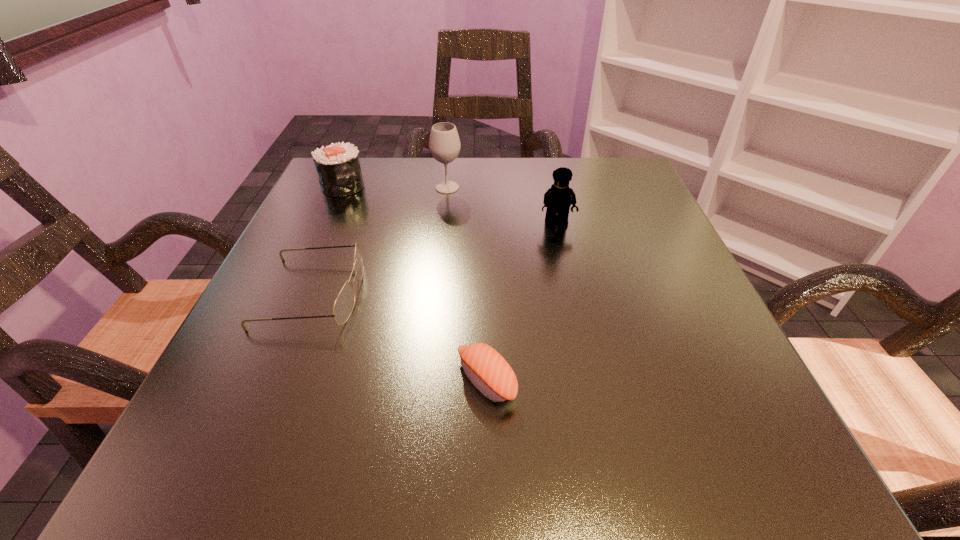
Locate an element on the screen. Image resolution: width=960 pixels, height=540 pixels. vacant region located 0.250m on the front-facing side of the third nearest object is located at coordinates (579, 326).

Where is `free spot located on the front of the farther sushi`? free spot located on the front of the farther sushi is located at coordinates (316, 247).

This screenshot has height=540, width=960. What are the coordinates of `free point located on the back of the right sushi` in the screenshot? It's located at (485, 261).

Locate an element on the screen. The image size is (960, 540). free spot located 0.260m on the front-facing side of the spectacles is located at coordinates (516, 293).

This screenshot has width=960, height=540. Identify the location of wineglass that is at the far edge. (444, 143).

Image resolution: width=960 pixels, height=540 pixels. I want to click on sushi that is positioned at the far edge, so (338, 167).

This screenshot has height=540, width=960. Identify the location of sushi that is at the left edge. (338, 167).

Locate an element on the screen. Image resolution: width=960 pixels, height=540 pixels. spectacles that is at the left edge is located at coordinates (343, 306).

Locate an element on the screen. The image size is (960, 540). object at the far left corner is located at coordinates (338, 167).

Locate an element on the screen. This screenshot has height=540, width=960. vacant space at the far edge of the desktop is located at coordinates (467, 183).